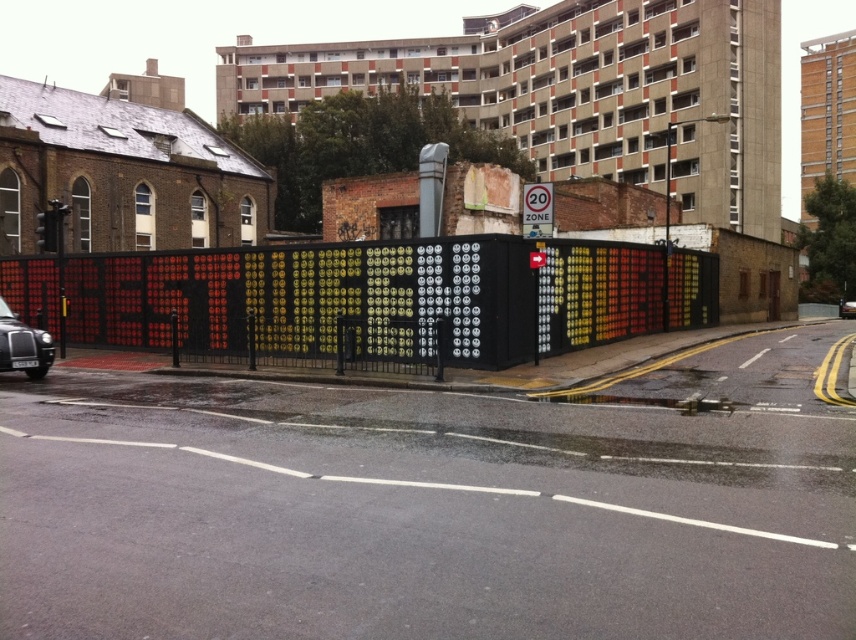
Is point (527, 193) behind point (846, 316)?

No, (527, 193) is closer to viewer.

The width and height of the screenshot is (856, 640). What do you see at coordinates (538, 209) in the screenshot?
I see `metallic rectangular sign at center` at bounding box center [538, 209].

You are a GUI agent. You are given a task and a screenshot of the screen. Output one action in this format:
    pyautogui.click(x=<x>, y=<y>)
    Task: Click on the metallic rectangular sign at center
    The image size is (856, 640).
    Given the screenshot: What is the action you would take?
    pyautogui.click(x=538, y=209)

Is metallic black fence at center smaller than black metallic car at center?

No.

Can you confirm if metallic black fence at center is wider than black metallic car at center?

Yes, metallic black fence at center is wider than black metallic car at center.

Who is more forward, (447, 328) or (843, 307)?

Point (447, 328)

This screenshot has width=856, height=640. In order to click on metallic black fence at center in this screenshot , I will do pos(372,298).

Between metallic black fence at center and metallic rectangular sign at center, which one has less height?

metallic rectangular sign at center is shorter.

Does point (197, 300) come behind point (535, 182)?

Yes.

Locate an element on the screen. metallic black fence at center is located at coordinates (372, 298).